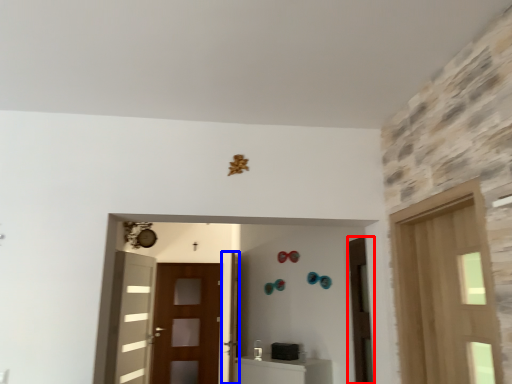
Question: Which of the following is the closest to the observer, door (highlighted by a red box) or door (highlighted by a blue box)?

Choices:
 (A) door
 (B) door

Answer: (A)